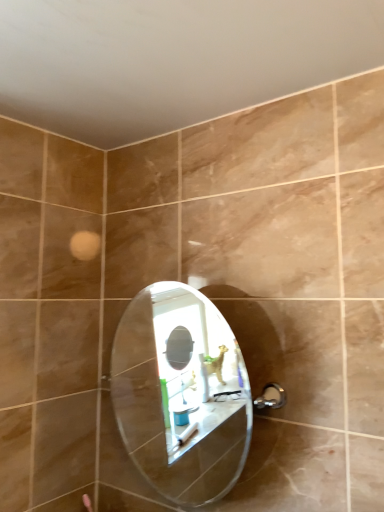
Question: Should I look upward or downward to see clear glass mirror at center?

Choices:
 (A) up
 (B) down

Answer: (B)